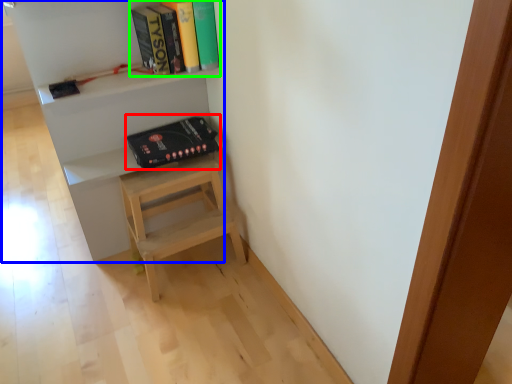
Question: Which object is positioned farthest from paperback book (highlighted by a red box)? Select from shelf (highlighted by a blue box) and book (highlighted by a green box).

Choices:
 (A) shelf
 (B) book

Answer: (B)